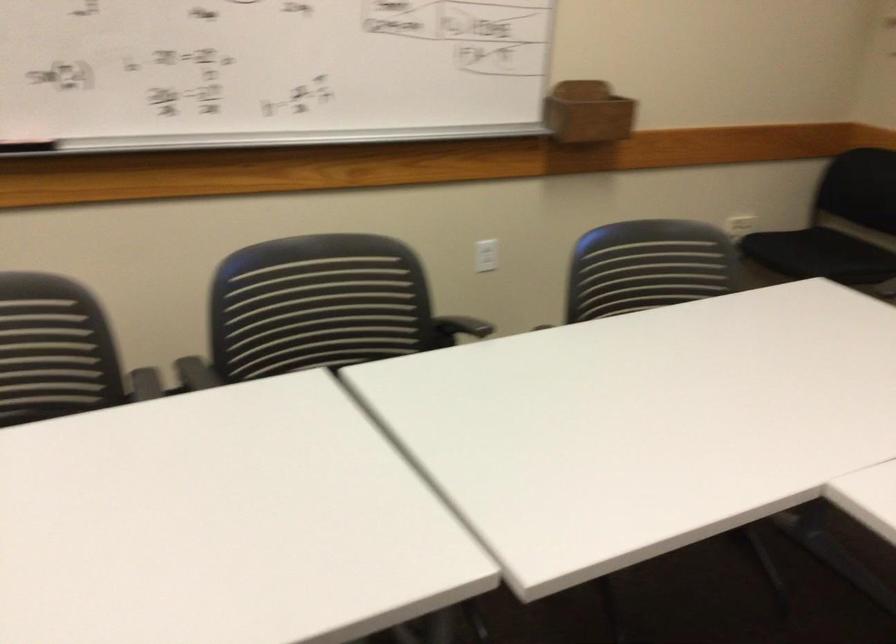
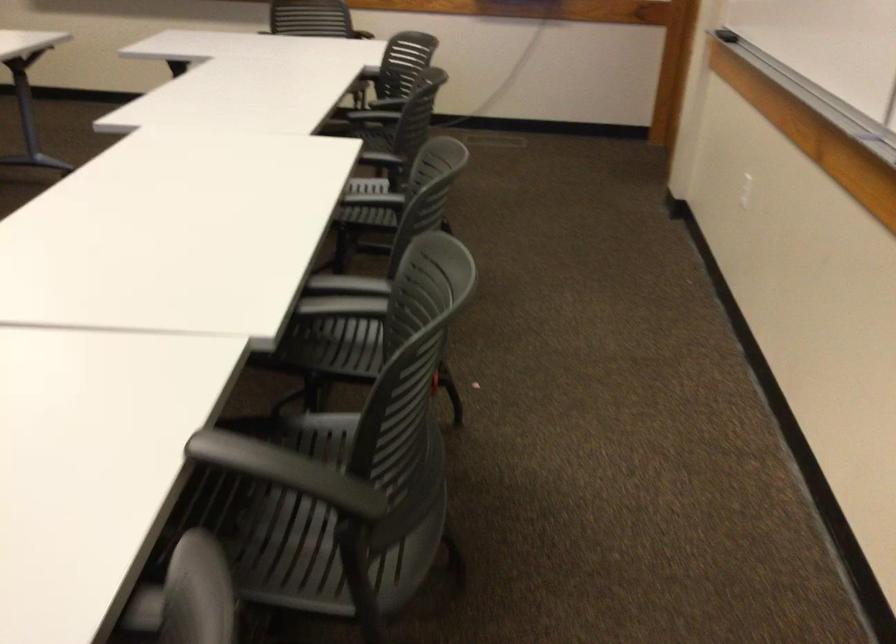
Where in the second image is the point corresponding to (186,389) from the first image?

(343, 297)